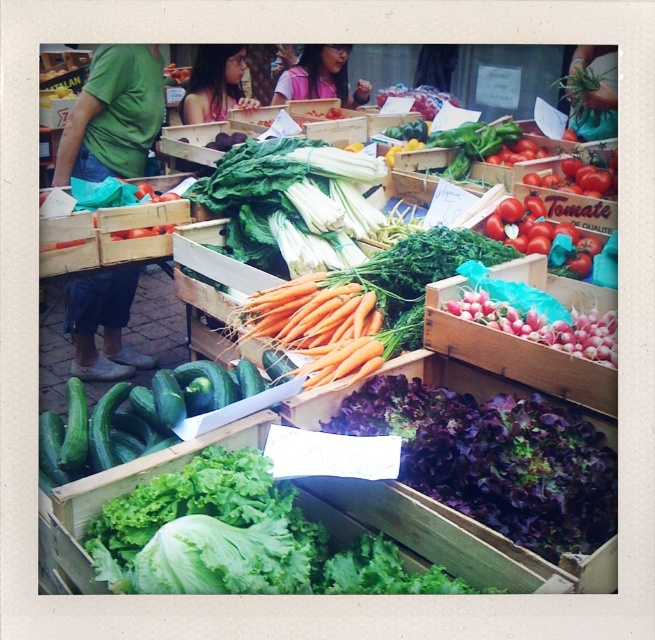
You are standing at the entrance of the market and want to find the green smooth cucumbers at center. According to the coordinates given, where should you look relative to the bottom left corner of the image?

The green smooth cucumbers at center are located at coordinates 0.653 on the x axis and 0.205 on the y axis relative to the bottom left corner of the image.

You are a customer at the market and want to grab both the purple leafy lettuce at center and the red matte tomatoes at upper right. Which one should you reach for first if you want to pick up the item that is closer to you?

The purple leafy lettuce at center is located below the red matte tomatoes at upper right, so it is closer to you. You should reach for the purple leafy lettuce at center first.